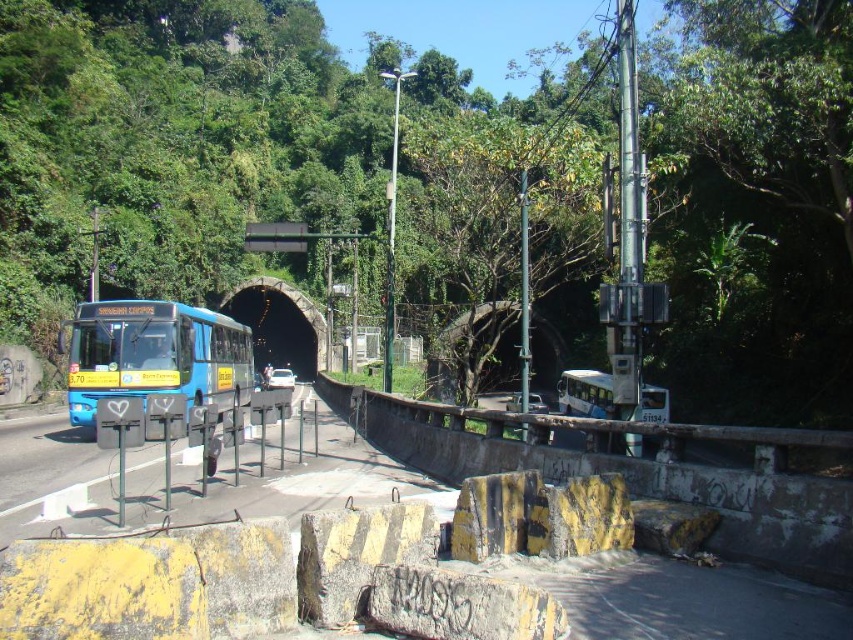
You are a pedestrian standing at the point marked by the coordinates (155, 355). You want to cross the road to reach the tunnel entrance. Is the blue matte bus at left blocking your path?

The point marked by the coordinates (155, 355) is on the blue matte bus at left, so you are currently on the bus and cannot cross the road to the tunnel entrance from there.

You are a pedestrian standing on the sidewalk near the road intersection. You see the blue matte bus at left and the black concrete tunnel at center. Which object is closer to you?

The blue matte bus at left is closer to you because it is positioned over the black concrete tunnel at center, indicating it is in front of the tunnel.